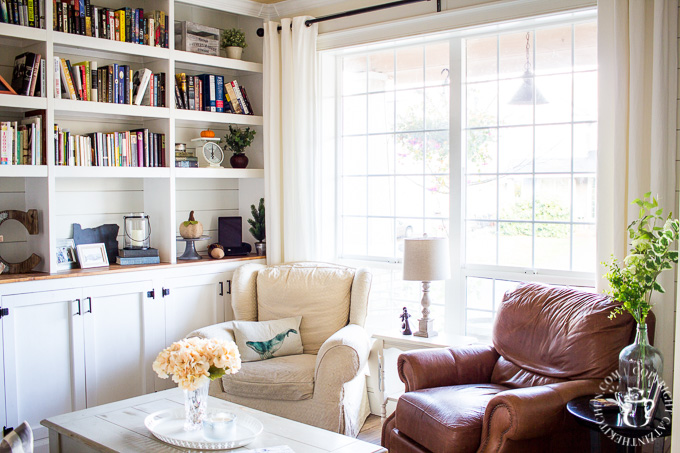
Where is `brown chair`? Image resolution: width=680 pixels, height=453 pixels. brown chair is located at coordinates (481, 388).